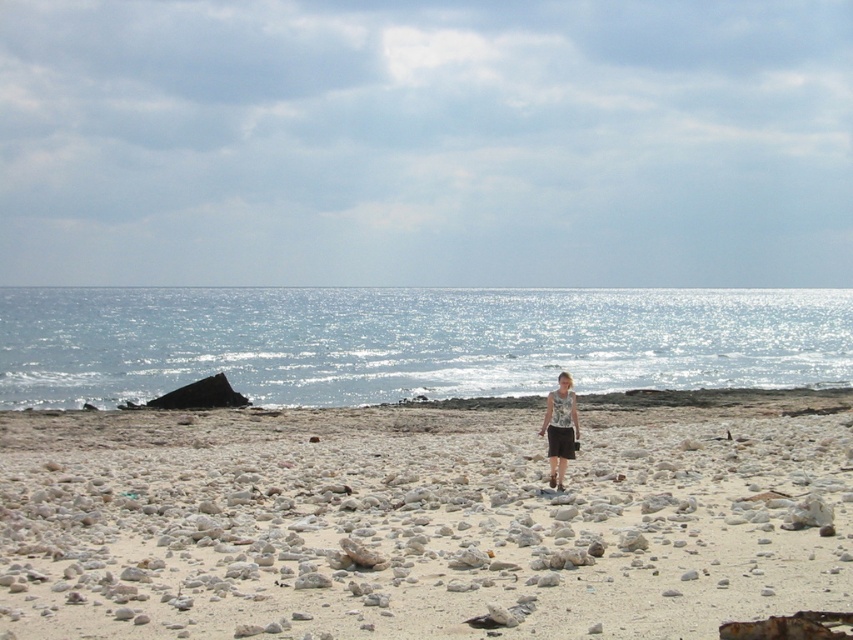
Which of these two, white sandy beach at center or glistening blue water at center, stands taller?

glistening blue water at center

Is white sandy beach at center shorter than glistening blue water at center?

Yes, white sandy beach at center is shorter than glistening blue water at center.

Is point (204, 460) behind point (36, 394)?

No, it is not.

Image resolution: width=853 pixels, height=640 pixels. I want to click on white sandy beach at center, so click(x=415, y=524).

Can you confirm if glistening blue water at center is positioned below brown cotton shorts at center?

No, glistening blue water at center is not below brown cotton shorts at center.

Who is more forward, (360, 333) or (567, 442)?

Positioned in front is point (567, 442).

Where is `glistening blue water at center`? This screenshot has height=640, width=853. glistening blue water at center is located at coordinates (410, 340).

Is matte gray tank top at center smaller than brown cotton shorts at center?

Actually, matte gray tank top at center might be larger than brown cotton shorts at center.

Which is behind, point (549, 436) or point (569, 435)?

The point (549, 436) is more distant.

Is point (543, 428) more distant than point (550, 444)?

Yes, it is.

You are a GUI agent. You are given a task and a screenshot of the screen. Output one action in this format:
    pyautogui.click(x=<x>, y=<y>)
    Task: Click on the matte gray tank top at center
    The image size is (853, 640).
    Given the screenshot: What is the action you would take?
    pyautogui.click(x=560, y=428)